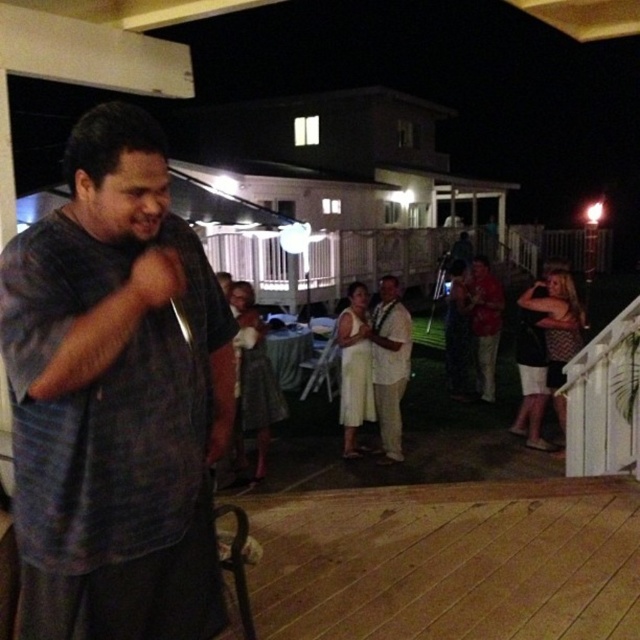
Question: Based on their relative distances, which object is nearer to the white satin dress at center?

Choices:
 (A) patterned fabric dress at right
 (B) white cotton shirt at center
 (C) white lace dress at center
 (D) red textured shirt at center

Answer: (B)

Question: Is dark blue shirt at center thinner than white satin dress at center?

Choices:
 (A) no
 (B) yes

Answer: (A)

Question: Can you confirm if white satin dress at center is bigger than red textured shirt at center?

Choices:
 (A) no
 (B) yes

Answer: (A)

Question: Among these points, which one is farthest from the camera?

Choices:
 (A) (140, 620)
 (B) (476, 266)

Answer: (B)

Question: Where is dark blue shirt at center located in relation to white lace dress at center in the image?

Choices:
 (A) right
 (B) left

Answer: (A)

Question: Which point is farther to the camera?

Choices:
 (A) dark blue shirt at center
 (B) white cotton shirt at center
 (C) patterned fabric dress at right

Answer: (C)